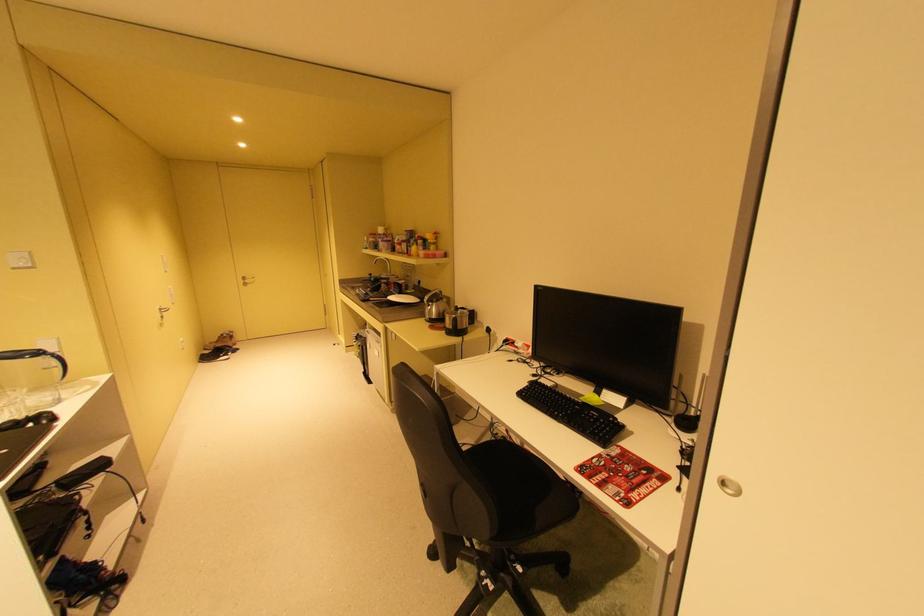
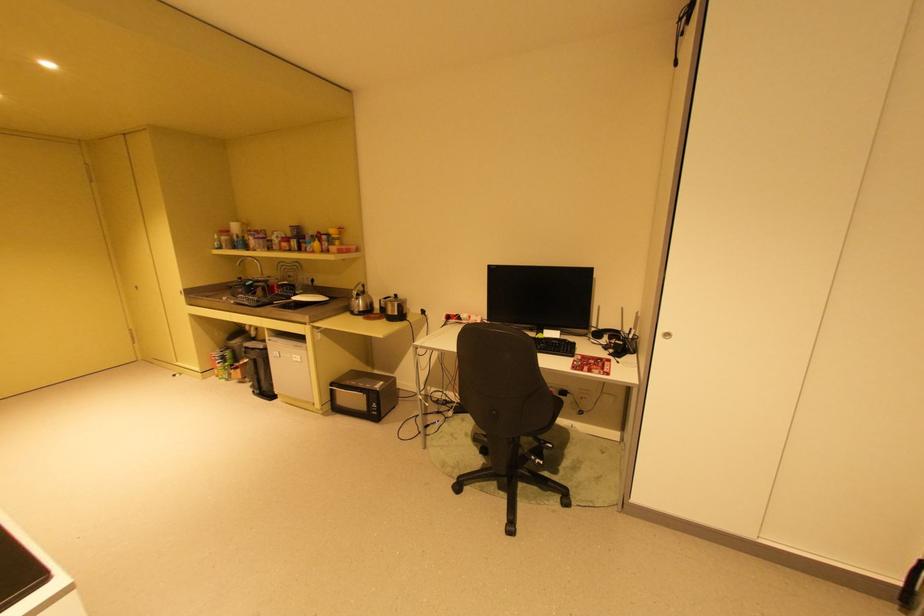
Locate, in the second image, the point that corresponds to (398,298) in the first image.

(304, 299)